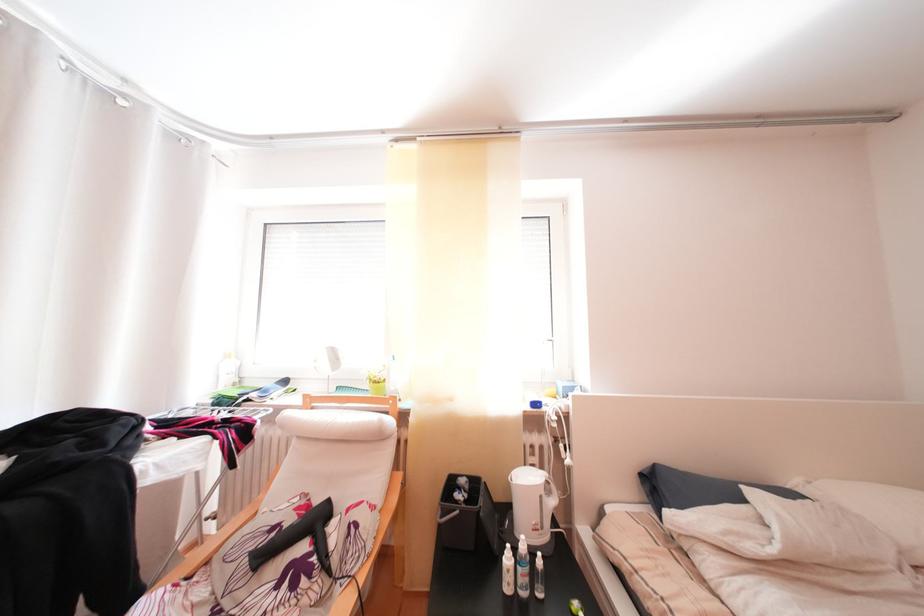
Where is `small clear bottle`? The image size is (924, 616). small clear bottle is located at coordinates (507, 570).